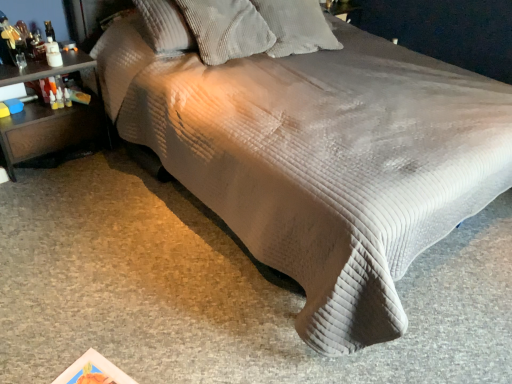
Where is `free space in front of brown wood nightstand at left`? The width and height of the screenshot is (512, 384). free space in front of brown wood nightstand at left is located at coordinates (47, 196).